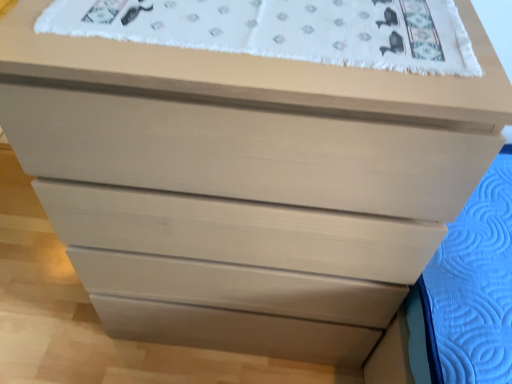
This screenshot has height=384, width=512. What are the coordinates of `white woven fabric at upper center` in the screenshot? It's located at point(285,29).

What do you see at coordinates (285, 29) in the screenshot? I see `white woven fabric at upper center` at bounding box center [285, 29].

Image resolution: width=512 pixels, height=384 pixels. Identify the location of white woven fabric at upper center. (285, 29).